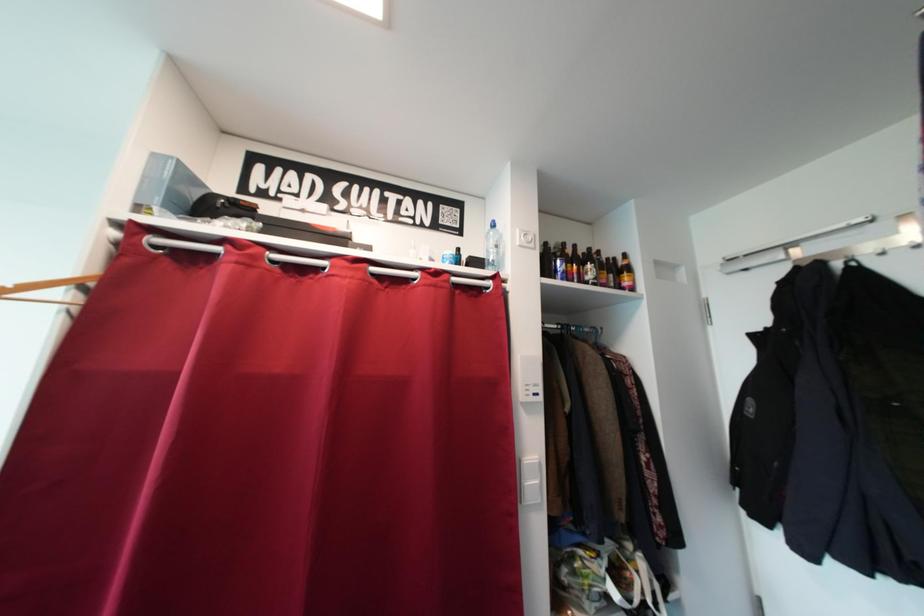
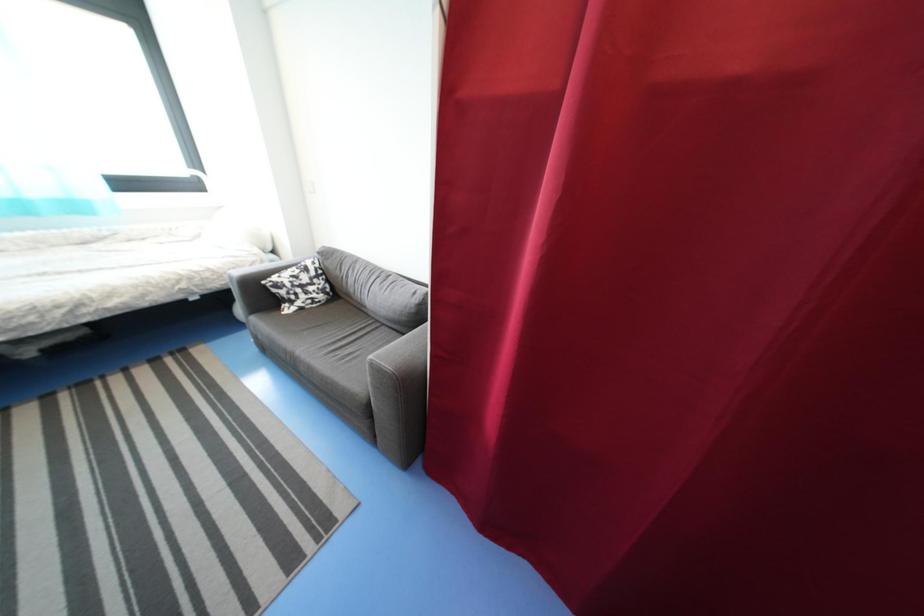
Looking at this image, first-person continuous shooting, in which direction is the camera rotating?

The camera rotated toward left-down.